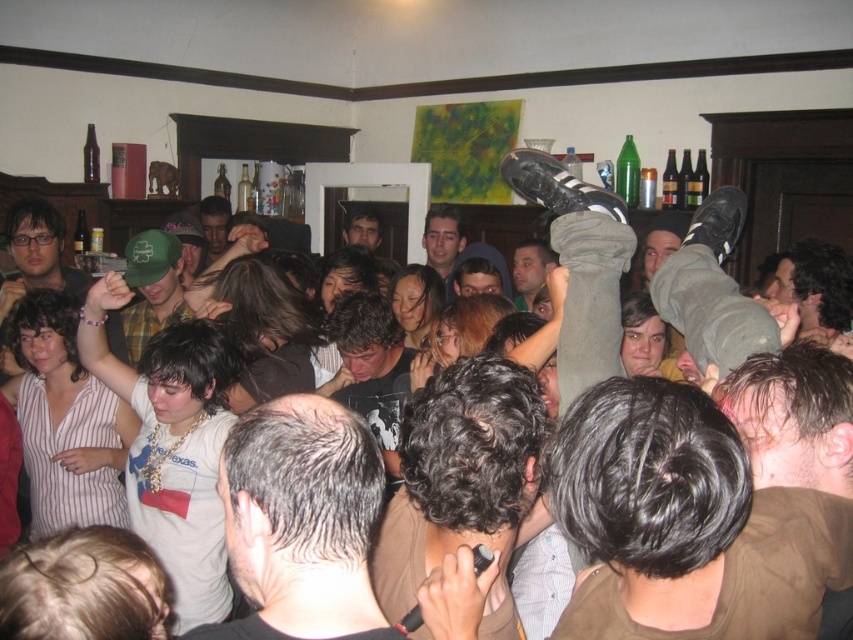
You are at a party and want to hand a drink to the person wearing the matte black shirt at center. You are currently standing 11.25 feet away from them. If the drink is 1 foot in length, can you reach them without moving closer?

The distance between you and the matte black shirt at center is 11.25 feet, and the drink is only 1 foot long. Since the drink cannot extend beyond your arm length, you cannot reach them without moving closer.

You are a photographer at the center of the room and want to capture both the matte black shirt at center and the matte green cap at center in a single photo. Since you can only focus on one subject at a time, which one should you focus on to ensure the other remains in the background?

The matte black shirt at center is much taller than the matte green cap at center, so focusing on the matte black shirt at center will keep the matte green cap at center in the background.

You are at a party and want to find the person wearing the green plaid shirt at center and the matte black shirt at center. Which of the two shirts is smaller in size?

The green plaid shirt at center is smaller than the matte black shirt at center.